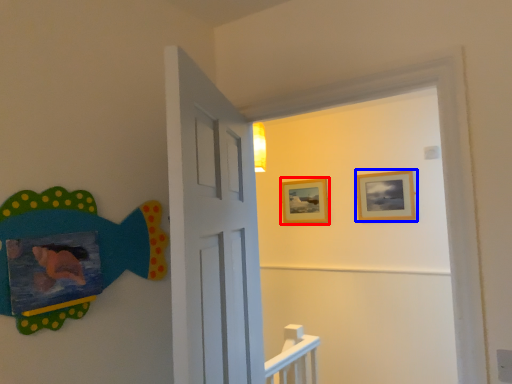
Question: Which object appears farthest to the camera in this image, picture frame (highlighted by a red box) or picture frame (highlighted by a blue box)?

Choices:
 (A) picture frame
 (B) picture frame

Answer: (A)